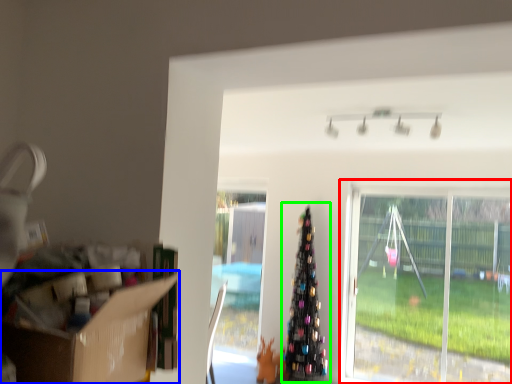
Question: Which is farther away from window (highlighted by a red box)? cardboard box (highlighted by a blue box) or christmas tree (highlighted by a green box)?

Choices:
 (A) cardboard box
 (B) christmas tree

Answer: (A)